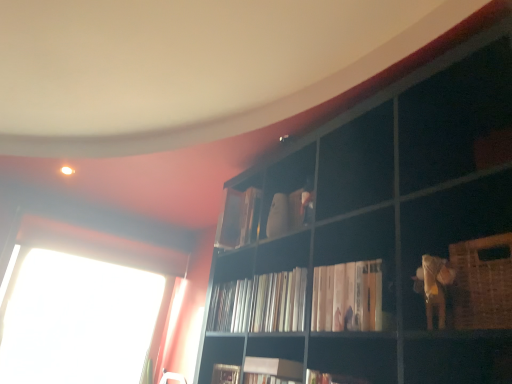
What is the approximate height of white matte book at center, which is the first book in front-to-back order?

white matte book at center, which is the first book in front-to-back order, is 8.30 inches tall.

Identify the location of white matte book at center, the fourth book viewed from the back. (347, 297).

Measure the distance between point (287,371) and camera.

Point (287,371) is 5.14 feet away from camera.

You are a GUI agent. You are given a task and a screenshot of the screen. Output one action in this format:
    pyautogui.click(x=<x>, y=<y>)
    Task: Click on the white matte bookshelf at center, the 3th book positioned from the back
    The height and width of the screenshot is (384, 512).
    Given the screenshot: What is the action you would take?
    pyautogui.click(x=271, y=370)

I want to click on woven brown basket at lower right, so click(x=482, y=284).

You are a GUI agent. You are given a task and a screenshot of the screen. Output one action in this format:
    pyautogui.click(x=<x>, y=<y>)
    Task: Click on the matte white book at upper center, which is the first book in back-to-front order
    Image resolution: width=512 pixels, height=384 pixels.
    Given the screenshot: What is the action you would take?
    pyautogui.click(x=237, y=217)

Which point is more distant from viewer, [268,358] or [330,323]?

The point [268,358] is behind.

From the image's perspective, is white matte bookshelf at center, which is the second book from front to back, located above or below white matte book at center, which is the first book in front-to-back order?

white matte bookshelf at center, which is the second book from front to back, is below white matte book at center, which is the first book in front-to-back order.

Can you confirm if white matte bookshelf at center, the 3th book positioned from the back, is thinner than white matte book at center, the fourth book viewed from the back?

Incorrect, the width of white matte bookshelf at center, the 3th book positioned from the back, is not less than that of white matte book at center, the fourth book viewed from the back.

Based on the photo, does white matte bookshelf at center, the 3th book positioned from the back, touch white glossy books at center?

No, white matte bookshelf at center, the 3th book positioned from the back, is not making contact with white glossy books at center.

Which is behind, white matte bookshelf at center, which is the second book from front to back, or white glossy books at center?

white matte bookshelf at center, which is the second book from front to back, is further from the camera.

Looking at this image, could you measure the distance between white matte bookshelf at center, the 3th book positioned from the back, and white glossy books at center?

A distance of 27.79 centimeters exists between white matte bookshelf at center, the 3th book positioned from the back, and white glossy books at center.

Is white matte bookshelf at center, the 3th book positioned from the back, facing away from white glossy books at center?

white matte bookshelf at center, the 3th book positioned from the back, is not turned away from white glossy books at center.

Is woven brown basket at lower right oriented towards white glossy books at center?

No, woven brown basket at lower right is not aimed at white glossy books at center.

Is the position of woven brown basket at lower right more distant than that of white glossy books at center?

No, woven brown basket at lower right is in front of white glossy books at center.

Between woven brown basket at lower right and white glossy books at center, which one appears on the left side from the viewer's perspective?

From the viewer's perspective, white glossy books at center appears more on the left side.

Is white matte book at center, which is the first book in front-to-back order, shorter than white glossy books at center?

Yes, white matte book at center, which is the first book in front-to-back order, is shorter than white glossy books at center.

Are white matte book at center, the fourth book viewed from the back, and white glossy books at center far apart?

No, there isn't a large distance between white matte book at center, the fourth book viewed from the back, and white glossy books at center.

In the image, is white matte book at center, which is the first book in front-to-back order, on the left side or the right side of white glossy books at center?

From the image, it's evident that white matte book at center, which is the first book in front-to-back order, is to the right of white glossy books at center.

From a real-world perspective, does white matte book at center, which is the first book in front-to-back order, sit lower than white glossy books at center?

Yes.

From the image's perspective, which is below, woven brown basket at lower right or matte white book at upper center, which is the first book in back-to-front order?

woven brown basket at lower right, from the image's perspective.

Is woven brown basket at lower right outside of matte white book at upper center, which is the first book in back-to-front order?

Absolutely, woven brown basket at lower right is external to matte white book at upper center, which is the first book in back-to-front order.

Does woven brown basket at lower right have a smaller size compared to matte white book at upper center, the 4th book when ordered from front to back?

Actually, woven brown basket at lower right might be larger than matte white book at upper center, the 4th book when ordered from front to back.

Who is more distant, woven brown basket at lower right or matte white book at upper center, the 4th book when ordered from front to back?

matte white book at upper center, the 4th book when ordered from front to back, is behind.

From a real-world perspective, is matte white book at upper center, the 4th book when ordered from front to back, physically above white matte bookshelf at center, which is the second book from front to back?

Yes.

Who is smaller, matte white book at upper center, which is the first book in back-to-front order, or white matte bookshelf at center, the 3th book positioned from the back?

Smaller between the two is white matte bookshelf at center, the 3th book positioned from the back.

Could you tell me if matte white book at upper center, which is the first book in back-to-front order, is facing white matte bookshelf at center, which is the second book from front to back?

No, matte white book at upper center, which is the first book in back-to-front order, is not oriented towards white matte bookshelf at center, which is the second book from front to back.

Does point (254, 195) come closer to viewer compared to point (255, 368)?

That is False.

At what (x,y) coordinates should I click in order to perform the action: click on cabinet that appears on the left of woven brown basket at lower right. Please return your answer as a coordinate pair (x, y). Looking at the image, I should click on (280, 286).

From the image's perspective, which one is positioned lower, white glossy books at center or woven brown basket at lower right?

white glossy books at center, from the image's perspective.

Looking at this image, between white glossy books at center and woven brown basket at lower right, which one has smaller width?

With smaller width is white glossy books at center.

Considering the relative positions of white glossy books at center and woven brown basket at lower right in the image provided, is white glossy books at center to the right of woven brown basket at lower right from the viewer's perspective?

No, white glossy books at center is not to the right of woven brown basket at lower right.

This screenshot has width=512, height=384. I want to click on book below the white matte book at center, which is the first book in front-to-back order (from a real-world perspective), so click(271, 370).

At what (x,y) coordinates should I click in order to perform the action: click on the 1st book counting from the left of the white glossy books at center. Please return your answer as a coordinate pair (x, y). The height and width of the screenshot is (384, 512). Looking at the image, I should click on (271, 370).

Looking at the image, which one is located further to white glossy books at center, matte white book at upper center, which is the first book in back-to-front order, or white matte bookshelf at center, the 3th book positioned from the back?

matte white book at upper center, which is the first book in back-to-front order, is further to white glossy books at center.

Which object lies further to the anchor point white matte book at center, the fourth book viewed from the back, white matte bookshelf at center, which is the second book from front to back, or white glossy books at center?

white matte bookshelf at center, which is the second book from front to back.

Looking at this image, from the image, which object appears to be nearer to white matte bookshelf at center, which is the second book from front to back, white glossy books at center or matte white book at upper center, which is the first book in back-to-front order?

white glossy books at center lies closer to white matte bookshelf at center, which is the second book from front to back, than the other object.

Which object lies further to the anchor point white matte book at center, the fourth book viewed from the back, woven brown basket at lower right or white matte bookshelf at center, which is the second book from front to back?

white matte bookshelf at center, which is the second book from front to back, lies further to white matte book at center, the fourth book viewed from the back, than the other object.

When comparing their distances from matte white book at upper center, which is the first book in back-to-front order, does white matte book at center, which is the first book in front-to-back order, or white matte bookshelf at center, the 3th book positioned from the back, seem closer?

white matte bookshelf at center, the 3th book positioned from the back, is positioned closer to the anchor matte white book at upper center, which is the first book in back-to-front order.

Based on their spatial positions, is white matte bookshelf at center, which is the second book from front to back, or woven brown basket at lower right further from white matte book at center, which is the first book in front-to-back order?

white matte bookshelf at center, which is the second book from front to back.

Considering their positions, is white paper book at center, marked as the second book in a back-to-front arrangement, positioned further to woven brown basket at lower right than white glossy books at center?

Among the two, white paper book at center, marked as the second book in a back-to-front arrangement, is located further to woven brown basket at lower right.

Considering their positions, is white matte book at center, the fourth book viewed from the back, positioned further to white matte bookshelf at center, the 3th book positioned from the back, than white glossy books at center?

Based on the image, white matte book at center, the fourth book viewed from the back, appears to be further to white matte bookshelf at center, the 3th book positioned from the back.

Where is `cabinet between woven brown basket at lower right and matte white book at upper center, the 4th book when ordered from front to back, from front to back`? This screenshot has width=512, height=384. cabinet between woven brown basket at lower right and matte white book at upper center, the 4th book when ordered from front to back, from front to back is located at coordinates (280, 286).

What are the coordinates of `book between white matte bookshelf at center, which is the second book from front to back, and woven brown basket at lower right, in the horizontal direction` in the screenshot? It's located at (347, 297).

Where is `book between white glossy books at center and white paper book at center, marked as the second book in a back-to-front arrangement, along the z-axis`? This screenshot has width=512, height=384. book between white glossy books at center and white paper book at center, marked as the second book in a back-to-front arrangement, along the z-axis is located at coordinates (271, 370).

You are a GUI agent. You are given a task and a screenshot of the screen. Output one action in this format:
    pyautogui.click(x=<x>, y=<y>)
    Task: Click on the cabinet between woven brown basket at lower right and white paper book at center, marked as the second book in a back-to-front arrangement, in the front-back direction
    This screenshot has width=512, height=384.
    Given the screenshot: What is the action you would take?
    pyautogui.click(x=280, y=286)